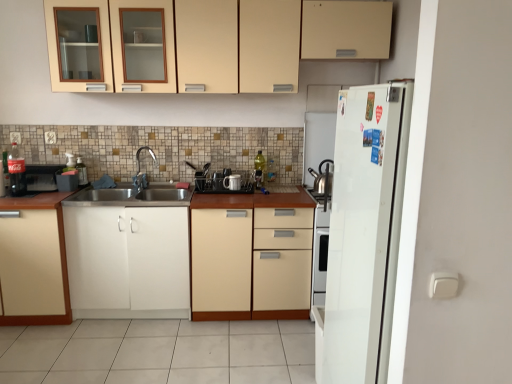
Locate an element on the screen. vacant area that lies to the right of white glossy mug at center, which is the 2th appliance in right-to-left order is located at coordinates (250, 192).